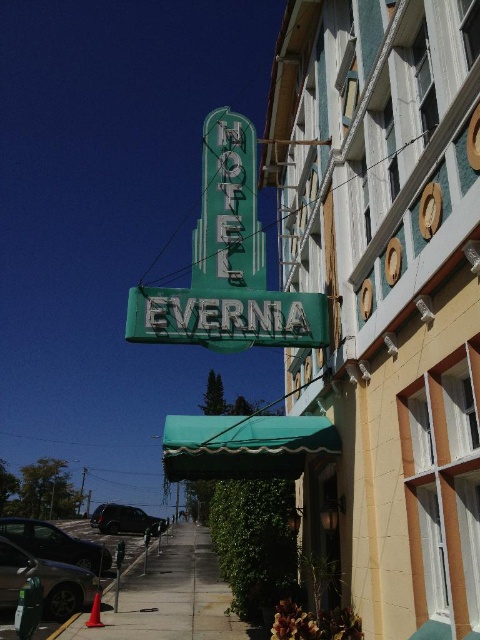
Question: Among these objects, which one is nearest to the camera?

Choices:
 (A) gray concrete sidewalk at lower center
 (B) metallic silver car at lower left
 (C) yellow brick building at center

Answer: (C)

Question: Does green neon sign at center have a smaller size compared to gray concrete sidewalk at lower center?

Choices:
 (A) no
 (B) yes

Answer: (B)

Question: Can you confirm if metallic silver car at lower left is positioned to the right of shiny black suv at lower left?

Choices:
 (A) no
 (B) yes

Answer: (B)

Question: Estimate the real-world distances between objects in this image. Which object is closer to the shiny black suv at lower left?

Choices:
 (A) gray concrete sidewalk at lower center
 (B) shiny silver sedan at lower left
 (C) yellow brick building at center
 (D) metallic silver car at lower left

Answer: (A)

Question: Observing the image, what is the correct spatial positioning of metallic silver car at lower left in reference to shiny silver sedan at lower left?

Choices:
 (A) below
 (B) above

Answer: (B)

Question: Which object is farther from the camera taking this photo?

Choices:
 (A) metallic silver car at lower left
 (B) shiny black suv at lower left

Answer: (B)